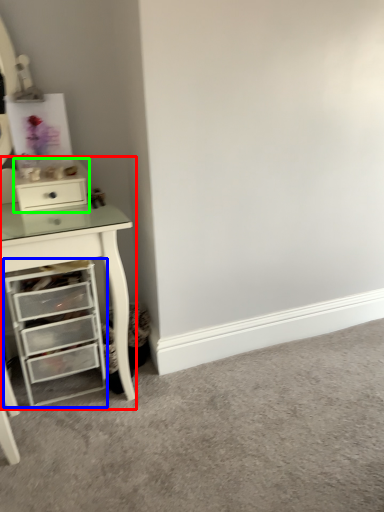
Question: Which object is the closest to the computer desk (highlighted by a red box)? Choose among these: chest of drawers (highlighted by a blue box) or file cabinet (highlighted by a green box).

Choices:
 (A) chest of drawers
 (B) file cabinet

Answer: (A)